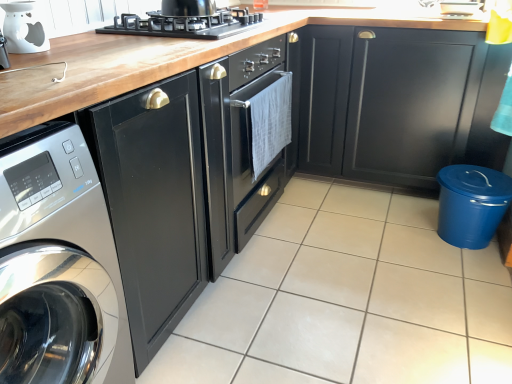
This screenshot has height=384, width=512. Identify the location of vacant space in front of blue plastic trash can at lower right, positioned as the first appliance in bottom-to-top order. (468, 274).